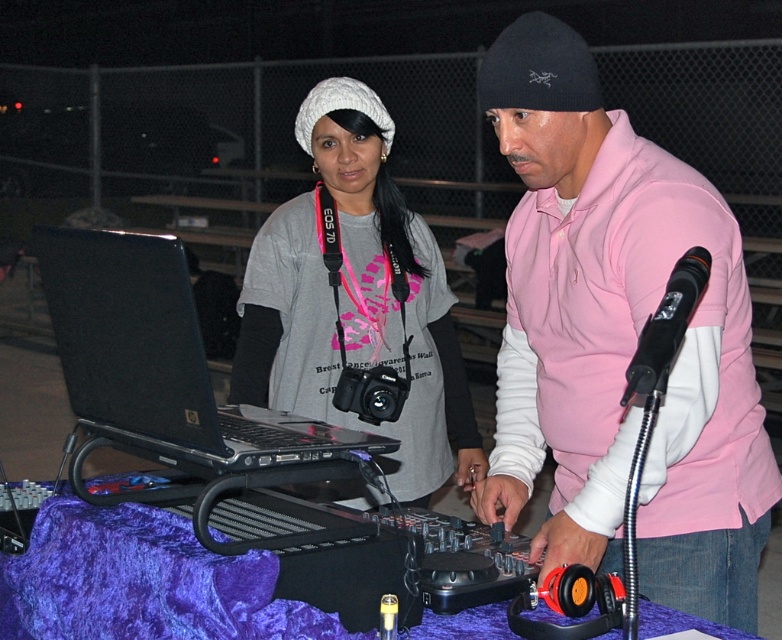
Question: Is pink matte shirt at center wider than black plastic laptop at left?

Choices:
 (A) yes
 (B) no

Answer: (A)

Question: Which is nearer to the black plastic laptop at left?

Choices:
 (A) matte gray shirt at center
 (B) black matte microphone at upper right

Answer: (B)

Question: Based on their relative distances, which object is farther from the purple velvet table at center?

Choices:
 (A) matte gray shirt at center
 (B) pink matte shirt at center
 (C) black plastic laptop at left

Answer: (A)

Question: Which point is farther to the camera?

Choices:
 (A) (623, 396)
 (B) (421, 426)

Answer: (B)

Question: Is matte gray shirt at center wider than purple velvet table at center?

Choices:
 (A) no
 (B) yes

Answer: (A)

Question: Does matte gray shirt at center appear on the right side of purple velvet table at center?

Choices:
 (A) no
 (B) yes

Answer: (A)